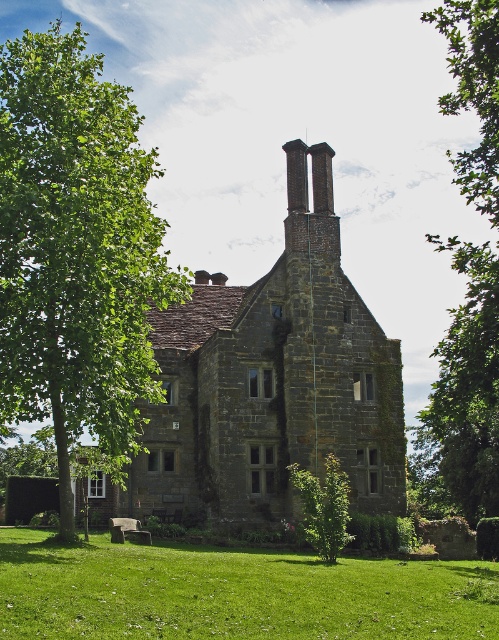
You are standing in front of the historic stone building and notice two points marked on the facade. The first point is at coordinates point (78,621) and the second is at point (484,106). Which of these points is closer to your current position?

Point (78,621) is closer to the camera than point (484,106), so the first point is closer to your current position.

You are a landscape architect planning to add a new garden feature between the green leafy tree at left and the green grass at lower center. Considering their sizes, which area would be more suitable for placing a large decorative fountain?

The green leafy tree at left is larger in size than the green grass at lower center, so the area near the green leafy tree at left would be more suitable for placing a large decorative fountain due to its greater space availability.